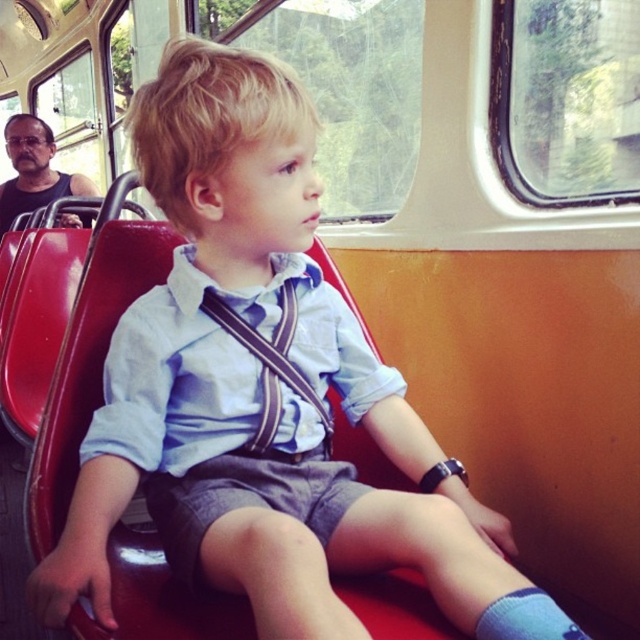
Question: Is striped fabric suspenders at center thinner than black tank top at left?

Choices:
 (A) no
 (B) yes

Answer: (B)

Question: Which point is farther to the camera?

Choices:
 (A) (68, 173)
 (B) (282, 314)

Answer: (A)

Question: Among these points, which one is farthest from the camera?

Choices:
 (A) (42, 196)
 (B) (285, 289)

Answer: (A)

Question: Can you confirm if striped fabric suspenders at center is smaller than black tank top at left?

Choices:
 (A) yes
 (B) no

Answer: (A)

Question: Can you confirm if striped fabric suspenders at center is positioned below black tank top at left?

Choices:
 (A) no
 (B) yes

Answer: (B)